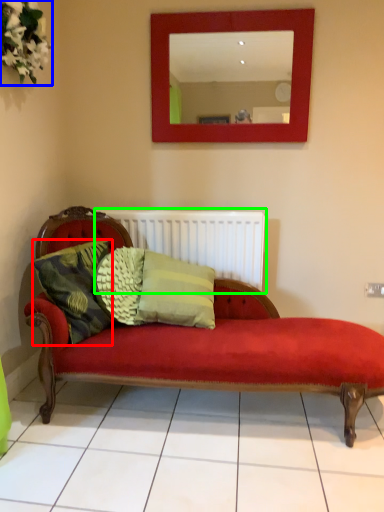
Question: Based on their relative distances, which object is farther from pillow (highlighted by a red box)? Choose from floral arrangement (highlighted by a blue box) and radiator (highlighted by a green box).

Choices:
 (A) floral arrangement
 (B) radiator

Answer: (A)